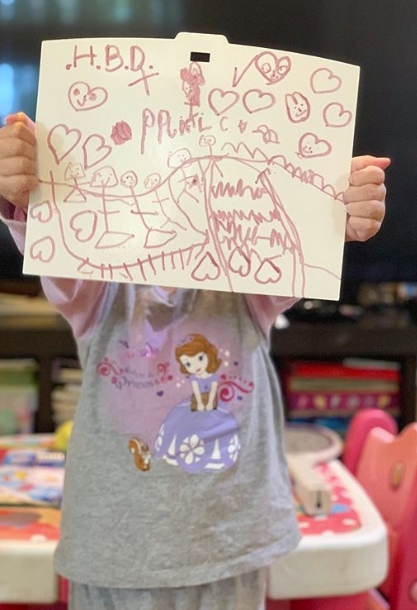
Locate an element on the screen. The image size is (417, 610). table is located at coordinates (347, 567).